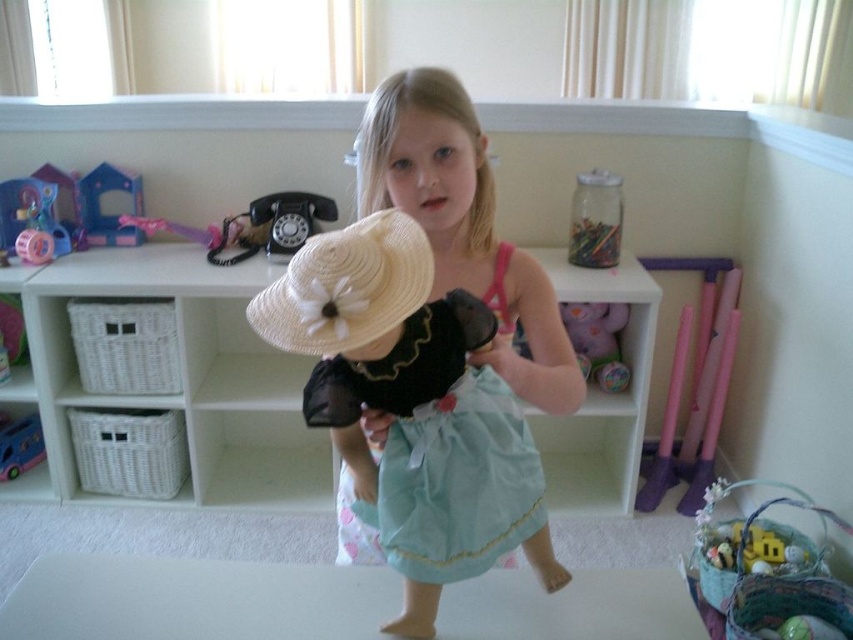
You are organizing the playroom and need to place a new toy between the white wicker basket at center and the matte plastic toy at left. Where should you place it so it is between them?

The white wicker basket at center is to the right of the matte plastic toy at left, so placing the new toy between them would require positioning it to the right of the matte plastic toy at left and to the left of the white wicker basket at center.

You are a child who wants to reach the matte plastic toy at left and the white wicker basket at center. Which object is easier to grab without moving your current position?

The white wicker basket at center is closer to the viewer than the matte plastic toy at left, so it is easier to grab without moving.